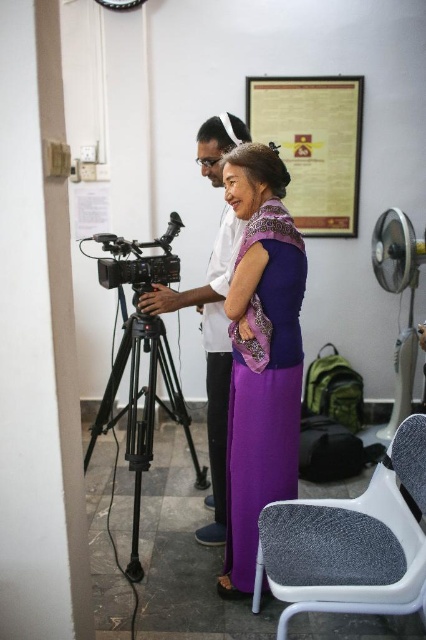
Question: Which point is closer to the camera?

Choices:
 (A) (131, 260)
 (B) (411, 525)
 (C) (268, 90)

Answer: (B)

Question: Is gold metallic plaque at upper center below matte white camera at left?

Choices:
 (A) yes
 (B) no

Answer: (B)

Question: Which of the following is the closest to the observer?

Choices:
 (A) (389, 486)
 (B) (103, 237)
 (C) (293, 492)
 (D) (164, 381)

Answer: (A)

Question: Does gray fabric chair at lower right appear over matte white camera at left?

Choices:
 (A) yes
 (B) no

Answer: (B)

Question: Observing the image, what is the correct spatial positioning of matte white camera at left in reference to black plastic camera at center?

Choices:
 (A) left
 (B) right

Answer: (B)

Question: Considering the real-world distances, which object is farthest from the matte white camera at left?

Choices:
 (A) black metallic tripod at lower left
 (B) gray fabric chair at lower right
 (C) purple satin dress at center
 (D) gold metallic plaque at upper center

Answer: (D)